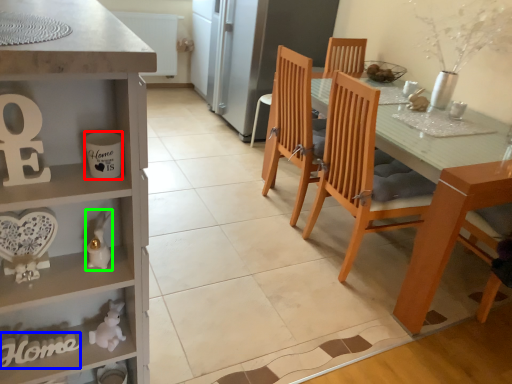
Question: Based on their relative distances, which object is nearer to coffee cup (highlighted by a red box)? Choose from writing (highlighted by a blue box) and toy (highlighted by a green box).

Choices:
 (A) writing
 (B) toy

Answer: (B)